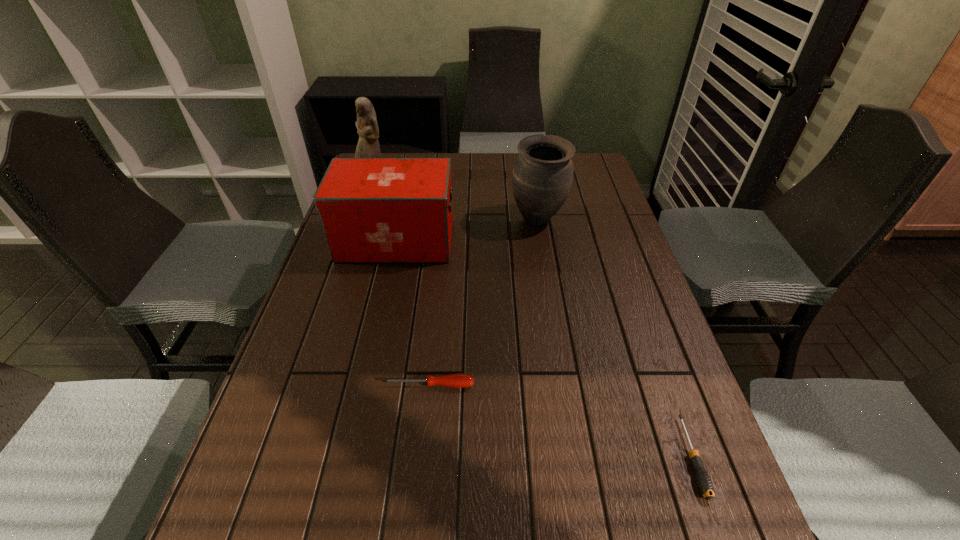
This screenshot has width=960, height=540. I want to click on free space between the second nearest object and the nearer screwdriver, so click(560, 421).

You are a GUI agent. You are given a task and a screenshot of the screen. Output one action in this format:
    pyautogui.click(x=<x>, y=<y>)
    Task: Click on the vacant space that's between the shorter screwdriver and the urn
    This screenshot has height=540, width=960.
    Given the screenshot: What is the action you would take?
    pyautogui.click(x=614, y=338)

The height and width of the screenshot is (540, 960). Find the location of `empty space between the second object from right to left and the farthest object`. empty space between the second object from right to left and the farthest object is located at coordinates tap(455, 199).

Locate an element on the screen. The image size is (960, 540). empty space between the shortest object and the urn is located at coordinates (614, 338).

Where is `empty space that is in between the fourth object from left to right and the farthest object`? This screenshot has width=960, height=540. empty space that is in between the fourth object from left to right and the farthest object is located at coordinates (455, 199).

In order to click on the second closest object to the figurine in this screenshot , I will do `click(542, 177)`.

You are a GUI agent. You are given a task and a screenshot of the screen. Output one action in this format:
    pyautogui.click(x=<x>, y=<y>)
    Task: Click on the object that stands as the third closest to the third shortest object
    This screenshot has height=540, width=960.
    Given the screenshot: What is the action you would take?
    pyautogui.click(x=458, y=380)

I want to click on the closest screwdriver relative to the second object from right to left, so click(x=458, y=380).

Find the location of a particular element. vacant area in the image that satisfies the following two spatial constraints: 1. on the front side of the fourth object from left to right; 2. on the handle side of the first-aid kit is located at coordinates (541, 241).

Find the location of a particular element. vacant region that satisfies the following two spatial constraints: 1. on the handle side of the first-aid kit; 2. on the right side of the nearer screwdriver is located at coordinates (348, 457).